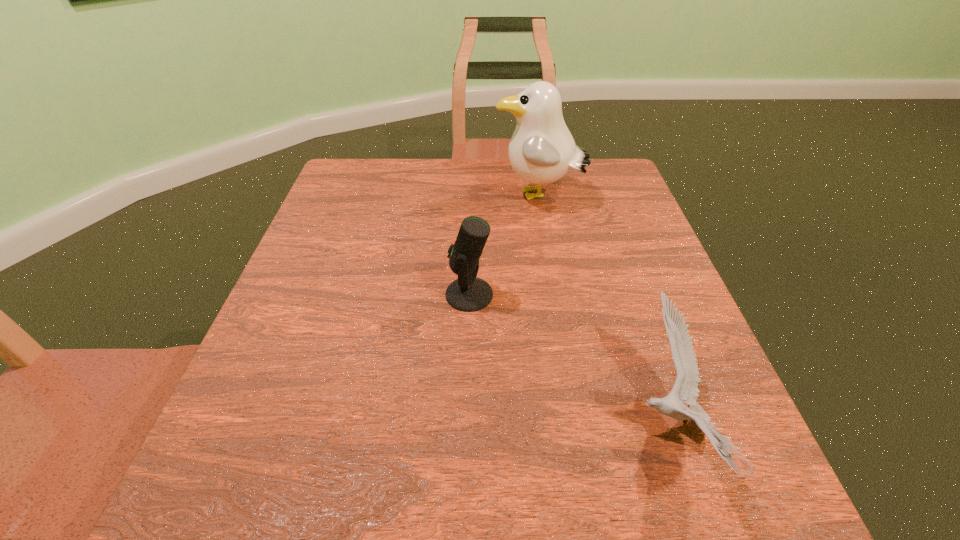
The width and height of the screenshot is (960, 540). In order to click on the tallest object in this screenshot , I will do `click(542, 150)`.

At what (x,y) coordinates should I click in order to perform the action: click on the farther gull. Please return your answer as a coordinate pair (x, y). This screenshot has height=540, width=960. Looking at the image, I should click on (542, 150).

Where is `microphone`? Image resolution: width=960 pixels, height=540 pixels. microphone is located at coordinates (468, 293).

This screenshot has height=540, width=960. I want to click on the leftmost object, so click(x=468, y=293).

The height and width of the screenshot is (540, 960). I want to click on the shortest object, so click(685, 390).

Locate an element on the screen. the nearer gull is located at coordinates (685, 390).

Identify the location of vacant space located 0.270m on the beak of the farther gull. The image size is (960, 540). (389, 197).

Identify the location of free space located on the beak of the farther gull. (338, 197).

At what (x,y) coordinates should I click in order to perform the action: click on blank area located 0.250m on the beak of the farther gull. Please return your answer as a coordinate pair (x, y). The image size is (960, 540). Looking at the image, I should click on (396, 197).

The image size is (960, 540). I want to click on blank space located 0.080m on the front of the microphone, so click(x=468, y=346).